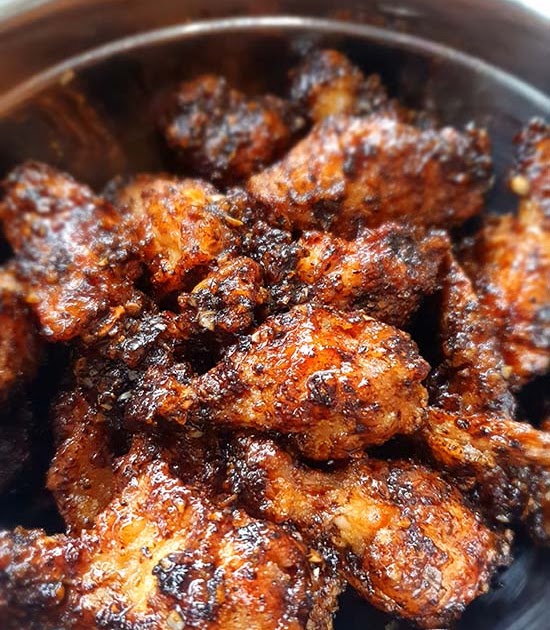
Where is `table`? table is located at coordinates (544, 11).